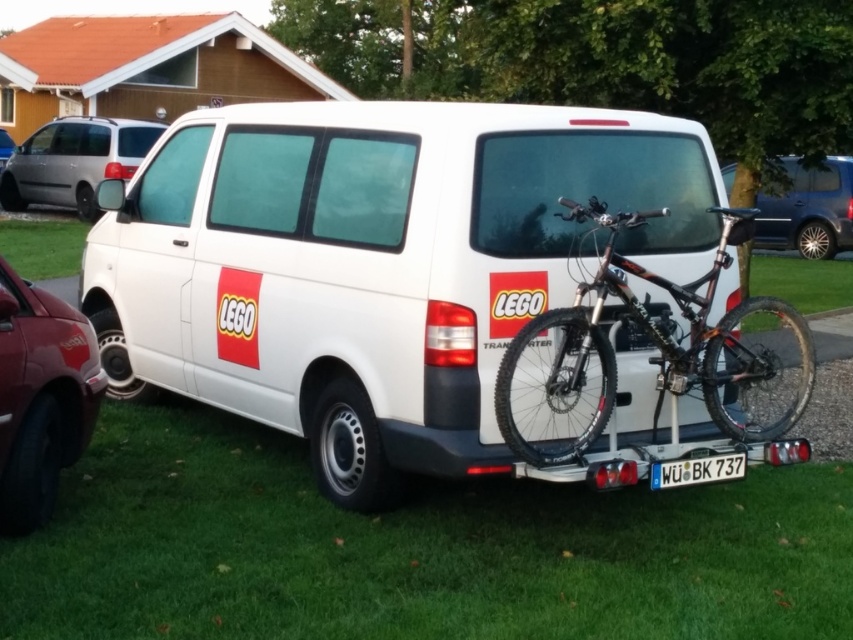
In the scene shown: You are a driver looking to park your car in the parking lot shown in the image. You see the shiny red car at lower left and the metallic blue minivan at upper right. Which vehicle is parked closer to the entrance of the parking lot?

The shiny red car at lower left is located below the metallic blue minivan at upper right, so it is likely closer to the entrance of the parking lot.

Consider the image. You are a delivery driver who needs to ensure the license plate is visible for security cameras. Given the positioning of the metallic silver car at upper left and the white plastic license plate at lower center, will the license plate be obscured by the car?

The white plastic license plate at lower center has a lesser width compared to the metallic silver car at upper left, so it is less likely to be obscured by the car. The license plate should remain visible.

In the scene shown: You are a pedestrian standing at the center of the image. You need to cross the road to reach the shiny red car at lower left and the satin silver van at upper left. Which vehicle should you approach first if you want to get to the one closer to your current position?

The shiny red car at lower left is positioned on the right side of the satin silver van at upper left, so the satin silver van at upper left is closer to your current position. Approach the satin silver van at upper left first.